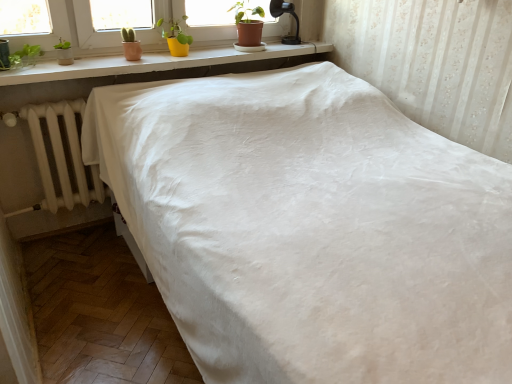
Question: Which direction should I rotate to face yellow matte pot at upper center, which is the second houseplant in right-to-left order, — up or down?

Choices:
 (A) up
 (B) down

Answer: (A)

Question: Is matte brown pot at upper center, the 1th houseplant viewed from the right, facing towards white matte radiator at left?

Choices:
 (A) yes
 (B) no

Answer: (B)

Question: Would you consider matte brown pot at upper center, the 1th houseplant viewed from the right, to be distant from white matte radiator at left?

Choices:
 (A) no
 (B) yes

Answer: (B)

Question: From the image's perspective, is matte brown pot at upper center, the second houseplant when ordered from left to right, on top of white matte radiator at left?

Choices:
 (A) no
 (B) yes

Answer: (B)

Question: From the image's perspective, is matte brown pot at upper center, the 1th houseplant viewed from the right, below white matte radiator at left?

Choices:
 (A) yes
 (B) no

Answer: (B)

Question: Is matte brown pot at upper center, the 1th houseplant viewed from the right, not within white matte radiator at left?

Choices:
 (A) yes
 (B) no

Answer: (A)

Question: From a real-world perspective, is matte brown pot at upper center, the 1th houseplant viewed from the right, below white matte radiator at left?

Choices:
 (A) no
 (B) yes

Answer: (A)

Question: Is black glass lamp at upper right not within yellow matte pot at upper center, which is the second houseplant in right-to-left order?

Choices:
 (A) no
 (B) yes

Answer: (B)

Question: Considering the relative sizes of black glass lamp at upper right and yellow matte pot at upper center, which is the second houseplant in right-to-left order, in the image provided, is black glass lamp at upper right shorter than yellow matte pot at upper center, which is the second houseplant in right-to-left order,?

Choices:
 (A) no
 (B) yes

Answer: (A)

Question: Is yellow matte pot at upper center, which is the second houseplant in right-to-left order, completely or partially inside black glass lamp at upper right?

Choices:
 (A) yes
 (B) no

Answer: (B)

Question: Is the depth of black glass lamp at upper right greater than that of yellow matte pot at upper center, marked as the first houseplant in a left-to-right arrangement?

Choices:
 (A) no
 (B) yes

Answer: (B)

Question: Is black glass lamp at upper right beside yellow matte pot at upper center, which is the second houseplant in right-to-left order?

Choices:
 (A) no
 (B) yes

Answer: (A)

Question: Considering the relative sizes of black glass lamp at upper right and yellow matte pot at upper center, which is the second houseplant in right-to-left order, in the image provided, is black glass lamp at upper right taller than yellow matte pot at upper center, which is the second houseplant in right-to-left order,?

Choices:
 (A) yes
 (B) no

Answer: (A)

Question: Can you confirm if yellow matte pot at upper center, marked as the first houseplant in a left-to-right arrangement, is thinner than white fabric bed at center?

Choices:
 (A) yes
 (B) no

Answer: (A)